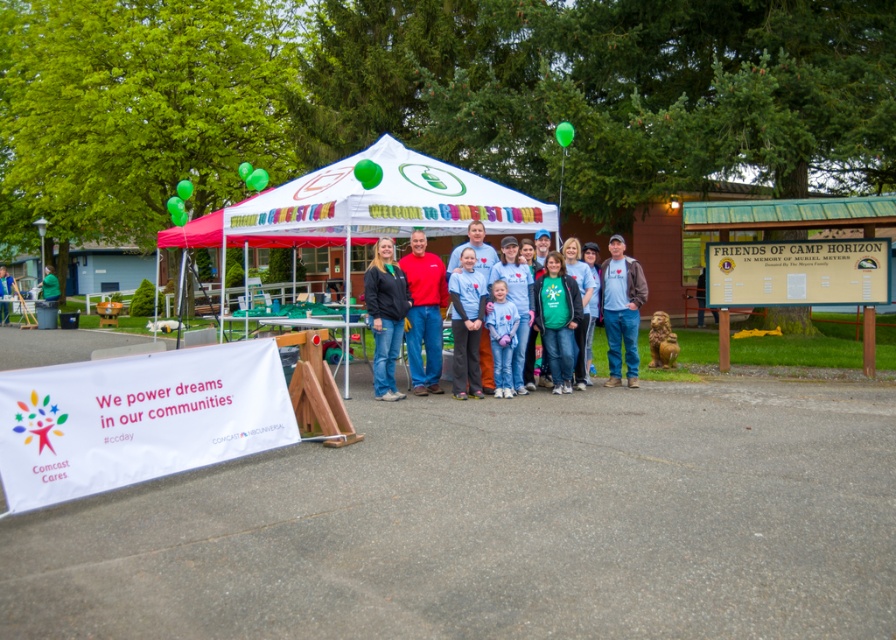
Question: Considering the relative positions of green matte shirt at center and blue t-shirt at center in the image provided, where is green matte shirt at center located with respect to blue t-shirt at center?

Choices:
 (A) left
 (B) right

Answer: (B)

Question: Which object appears closest to the camera in this image?

Choices:
 (A) white fabric canopy at center
 (B) black matte jacket at center
 (C) matte black jacket at center

Answer: (B)

Question: Does white fabric canopy at center lie in front of light blue fabric shirt at center?

Choices:
 (A) yes
 (B) no

Answer: (B)

Question: Which point is farther to the camera?

Choices:
 (A) matte gray t-shirt at center
 (B) matte black jacket at center
 (C) white fabric canopy at center

Answer: (B)

Question: Based on their relative distances, which object is nearer to the green fabric at center?

Choices:
 (A) white fabric canopy at center
 (B) light blue fabric shirt at center
 (C) matte gray t-shirt at center
 (D) blue t-shirt at center

Answer: (D)

Question: Does red matte shirt at center have a smaller size compared to matte black jacket at center?

Choices:
 (A) yes
 (B) no

Answer: (A)